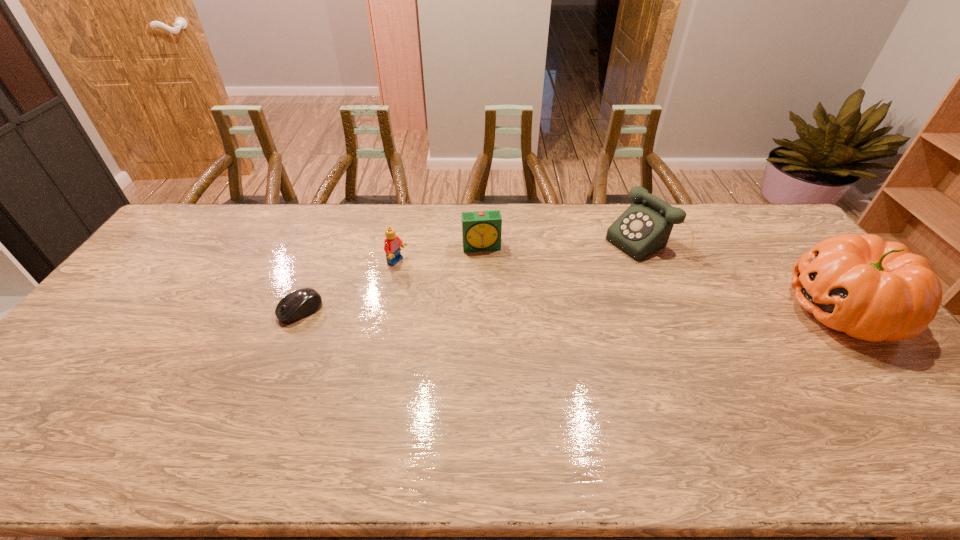
At what (x,y) coordinates should I click in order to perform the action: click on free space on the desktop that is between the mouse and the tallest object and is positioned on the front-facing side of the third object from right to left. Please return your answer as a coordinate pair (x, y). Looking at the image, I should click on (492, 310).

Where is `free space on the desktop that is between the shortest object and the pumpkin and is positioned on the dial of the fourth shortest object`? free space on the desktop that is between the shortest object and the pumpkin and is positioned on the dial of the fourth shortest object is located at coordinates (522, 310).

Locate an element on the screen. vacant space on the desktop that is between the leftmost object and the tallest object and is positioned on the face of the second object from left to right is located at coordinates pyautogui.click(x=508, y=310).